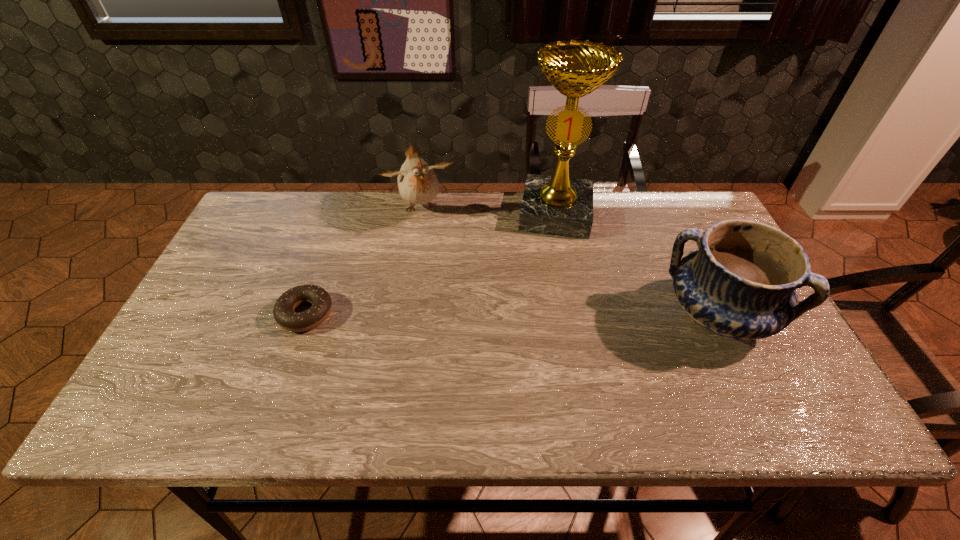
The width and height of the screenshot is (960, 540). Identify the location of free space located on the front-facing side of the tallest object. (551, 260).

Find the location of a particular element. free space located 0.230m at the beak of the second object from left to right is located at coordinates (447, 277).

Locate an element on the screen. The image size is (960, 540). vacant space located 0.400m at the beak of the second object from left to right is located at coordinates (465, 325).

Locate an element on the screen. free space located 0.380m at the beak of the second object from left to right is located at coordinates (462, 318).

You are a GUI agent. You are given a task and a screenshot of the screen. Output one action in this format:
    pyautogui.click(x=<x>, y=<y>)
    Task: Click on the award that is at the far edge
    
    Given the screenshot: What is the action you would take?
    click(x=558, y=205)

Find the location of a particular element. This screenshot has height=540, width=960. bird at the far edge is located at coordinates (417, 182).

This screenshot has height=540, width=960. What are the coordinates of `object present at the near edge` in the screenshot? It's located at (741, 282).

Image resolution: width=960 pixels, height=540 pixels. In order to click on object located at the right edge in this screenshot , I will do coord(741,282).

You are a GUI agent. You are given a task and a screenshot of the screen. Output one action in this format:
    pyautogui.click(x=<x>, y=<y>)
    Task: Click on the object that is at the near right corner
    The width and height of the screenshot is (960, 540).
    Given the screenshot: What is the action you would take?
    pyautogui.click(x=741, y=282)

Where is `blank space at the far edge of the desktop`? The image size is (960, 540). blank space at the far edge of the desktop is located at coordinates (605, 215).